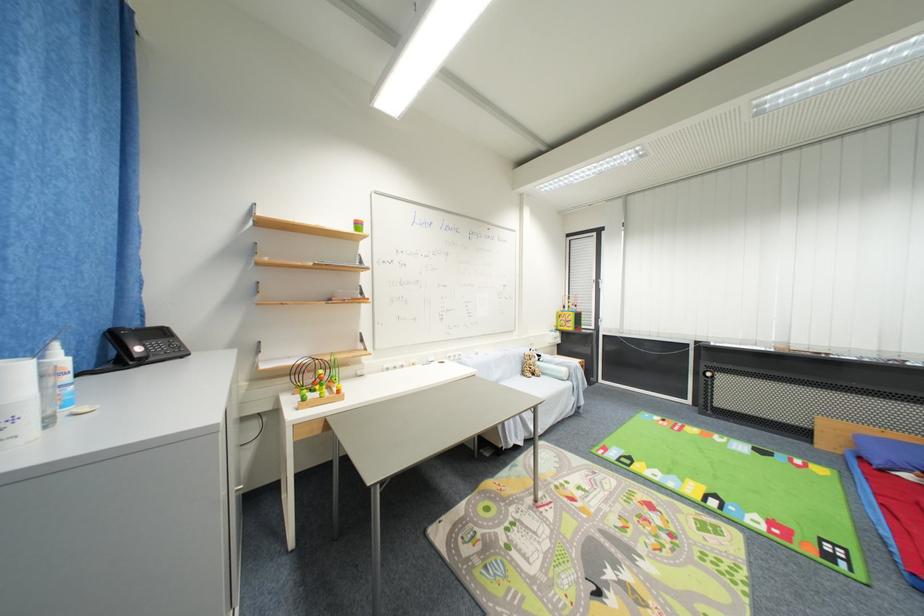
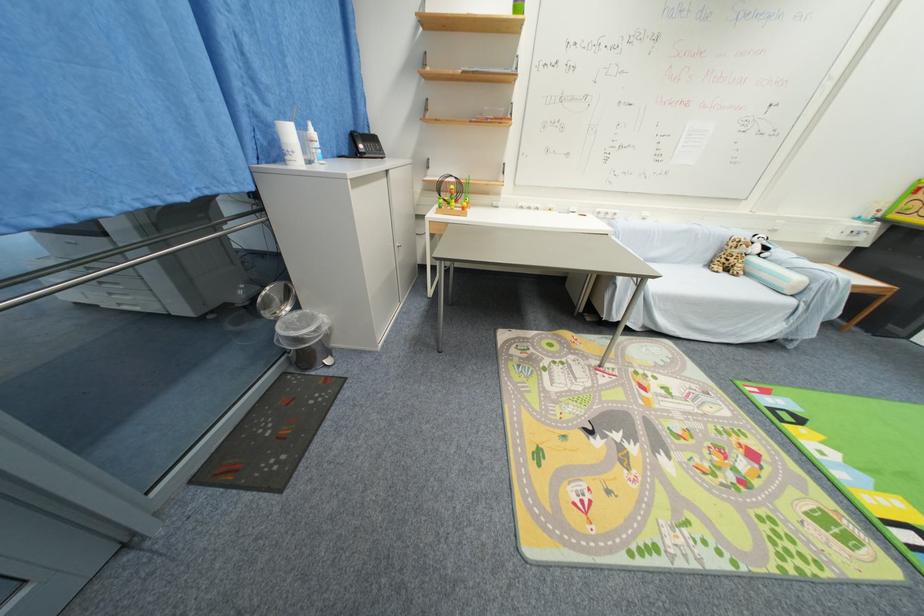
Where in the second image is the point corresponding to (528,376) from the first image?

(714, 265)